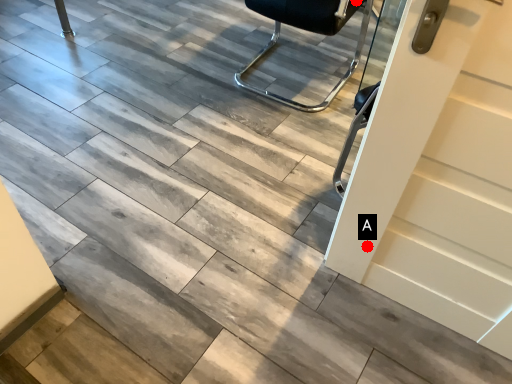
Question: Two points are circled on the image, labeled by A and B beside each circle. Which point appears farthest from the camera in this image?

Choices:
 (A) A is further
 (B) B is further

Answer: (B)